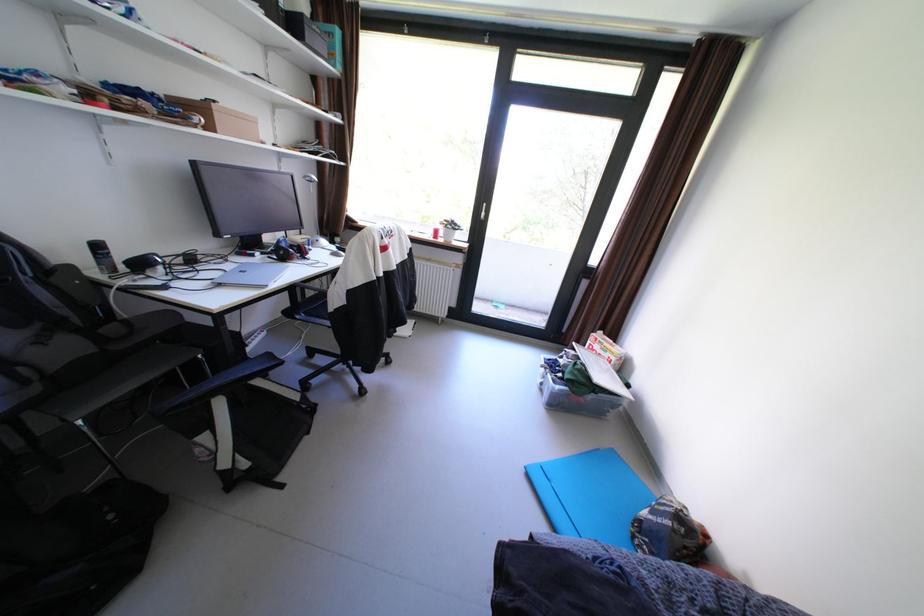
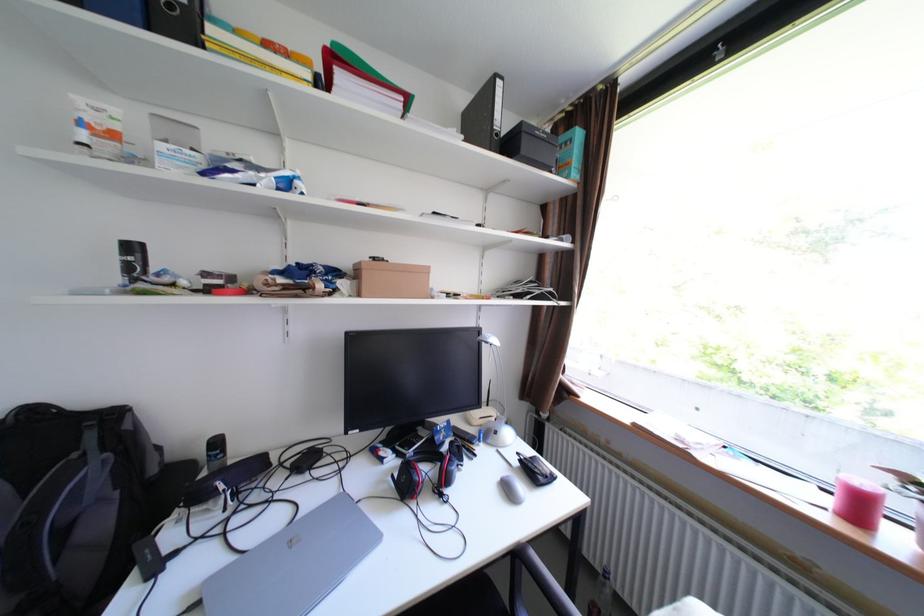
Locate, in the second image, the point that corresponds to (x=226, y=116) in the first image.

(375, 275)